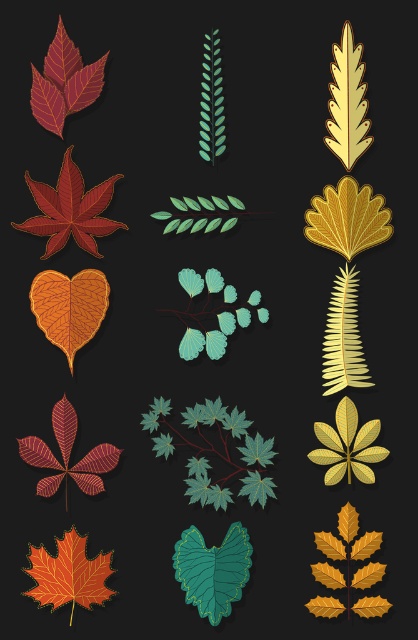
Question: In this image, where is matte red maple leaf at center-left located relative to gold metallic maple leaf at center right?

Choices:
 (A) left
 (B) right

Answer: (A)

Question: Does gold metallic maple leaf at center right appear on the right side of matte red maple leaf at center?

Choices:
 (A) yes
 (B) no

Answer: (A)

Question: Based on their relative distances, which object is nearer to the gold metallic maple leaf at center right?

Choices:
 (A) matte red maple leaf at center-left
 (B) teal glossy leaf at center
 (C) matte red maple leaf at center

Answer: (A)

Question: Which point is closer to the camera?

Choices:
 (A) orange matte maple leaf at lower left
 (B) gold metallic maple leaf at center right
 (C) matte red maple leaf at center

Answer: (A)

Question: Considering the real-world distances, which object is closest to the teal glossy leaf at center?

Choices:
 (A) matte red maple leaf at upper left
 (B) orange matte maple leaf at lower left
 (C) matte red maple leaf at center-left

Answer: (B)

Question: Can you confirm if orange matte heart-shaped leaf at center-left is positioned above matte red maple leaf at upper left?

Choices:
 (A) no
 (B) yes

Answer: (A)